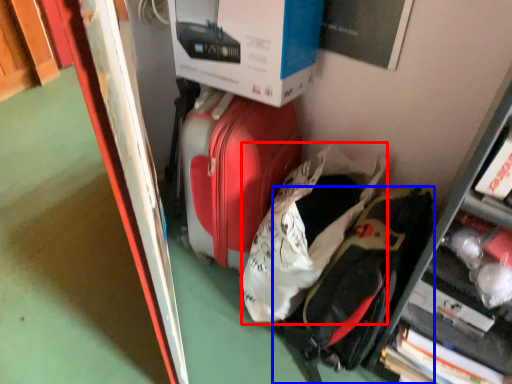
Question: Which object appears farthest to the camera in this image, luggage (highlighted by a red box) or backpack (highlighted by a blue box)?

Choices:
 (A) luggage
 (B) backpack

Answer: (A)